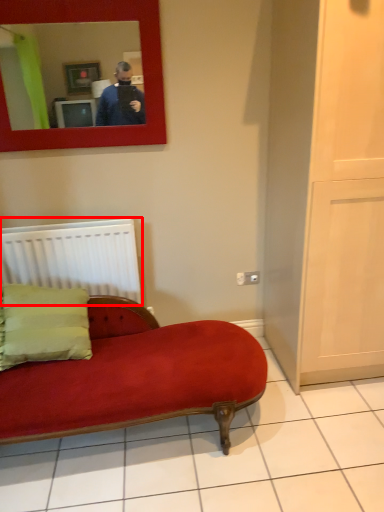
Question: From the image's perspective, where is radiator (annotated by the red box) located in relation to mirror in the image?

Choices:
 (A) above
 (B) below

Answer: (B)